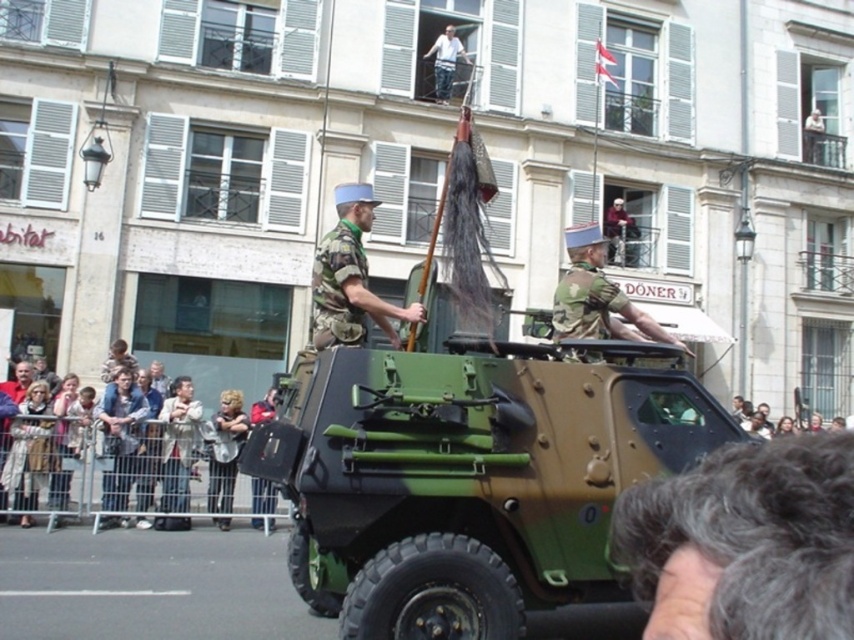
You are observing a military parade scene. You notice two distinct features in the image. One is the gray curly hair at lower right and the other is the striped fabric jacket at lower left. Which of these two features is narrower in width?

The gray curly hair at lower right has a lesser width compared to the striped fabric jacket at lower left, so the gray curly hair at lower right is narrower in width.

You are a photographer trying to capture a clear shot of the gray curly hair at lower right and the light brown wooden fence at lower left. Which object is closer to the camera, and why?

The gray curly hair at lower right is closer to the camera because it is positioned in front of the light brown wooden fence at lower left.